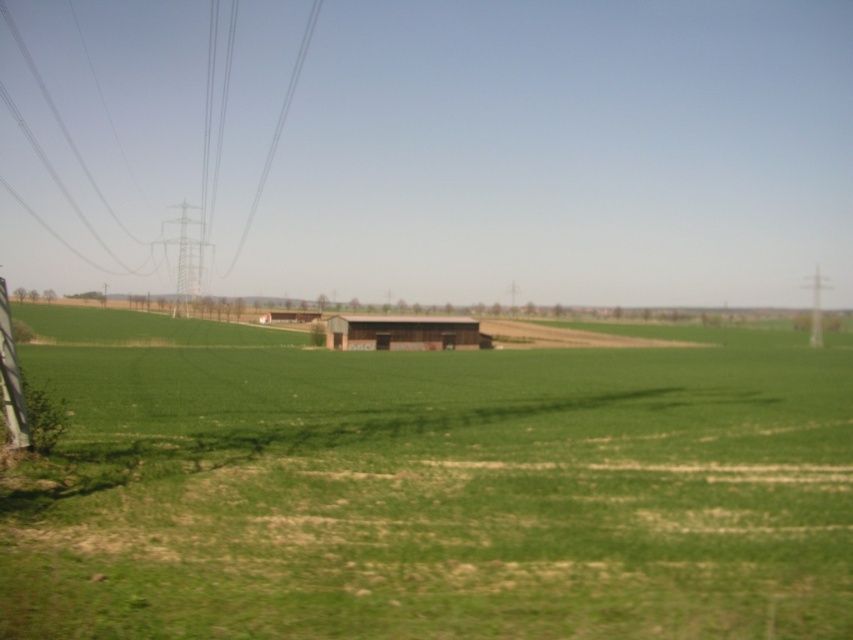
You are a farmer planning to install a new fence. You have a roll of fencing material that can cover an area equal to the size of the green grassy field at center. Can you determine if this fencing material will be sufficient to cover the metallic wire at left?

The green grassy field at center is smaller than the metallic wire at left, so the fencing material may not be sufficient to cover the metallic wire at left.

You are a farmer checking the layout of your land. You notice the green grassy field at center and the metallic wire at left. Which one is located to the right of the other?

The green grassy field at center is positioned on the right side of metallic wire at left.

You are a farmer checking the height of crops in your field. You notice the green grassy field at center and the metallic wire at left. Which one has a greater height?

The metallic wire at left is taller than the green grassy field at center.